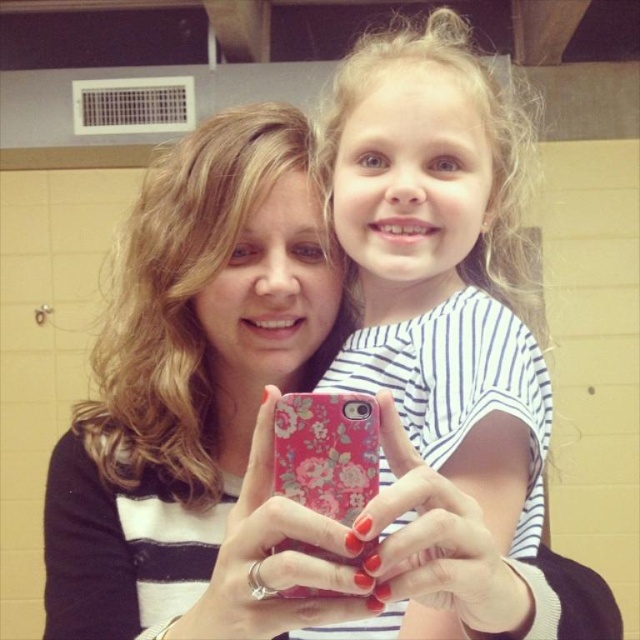
Question: Which of these objects is positioned closest to the matte black shirt at center?

Choices:
 (A) floral-patterned phone at center
 (B) white striped shirt at upper center

Answer: (B)

Question: Is matte black shirt at center further to camera compared to floral-patterned phone at center?

Choices:
 (A) no
 (B) yes

Answer: (A)

Question: Which object appears farthest from the camera in this image?

Choices:
 (A) matte black shirt at center
 (B) floral-patterned phone at center

Answer: (B)

Question: Is white striped shirt at upper center wider than floral-patterned phone at center?

Choices:
 (A) no
 (B) yes

Answer: (B)

Question: Is matte black shirt at center bigger than white striped shirt at upper center?

Choices:
 (A) yes
 (B) no

Answer: (B)

Question: Which object is closer to the camera taking this photo?

Choices:
 (A) matte black shirt at center
 (B) floral-patterned phone at center
 (C) white striped shirt at upper center

Answer: (C)